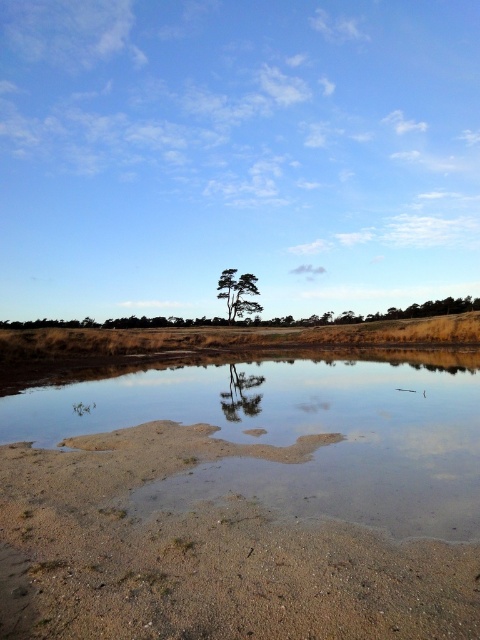
Based on the coordinates provided, what is located at point (300, 435) in the image?

The point (300, 435) corresponds to clear water at center.